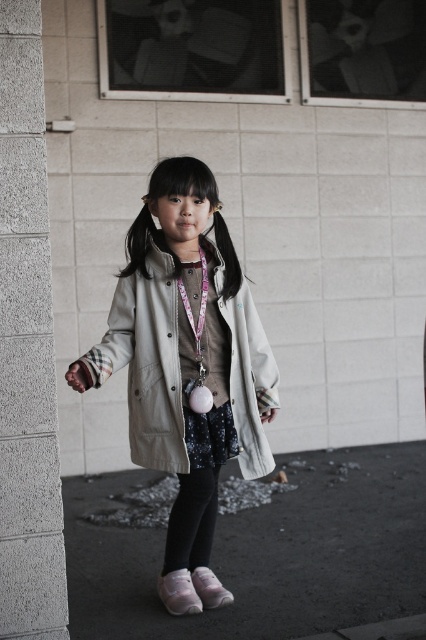
Question: Which point is farther to the camera?

Choices:
 (A) (342, 600)
 (B) (187, 584)

Answer: (B)

Question: Among these points, which one is nearest to the camera?

Choices:
 (A) (229, 426)
 (B) (23, 420)
 (C) (143, 486)
 (D) (207, 605)

Answer: (B)

Question: Is black asphalt at lower center to the left of gray concrete pillar at left from the viewer's perspective?

Choices:
 (A) yes
 (B) no

Answer: (B)

Question: Which point is closer to the camera?

Choices:
 (A) (9, 86)
 (B) (181, 348)

Answer: (A)

Question: Does pink fabric lanyard at center have a larger size compared to white suede shoe at lower center?

Choices:
 (A) no
 (B) yes

Answer: (B)

Question: Considering the relative positions of matte beige coat at center and gray concrete pillar at left in the image provided, where is matte beige coat at center located with respect to gray concrete pillar at left?

Choices:
 (A) left
 (B) right

Answer: (B)